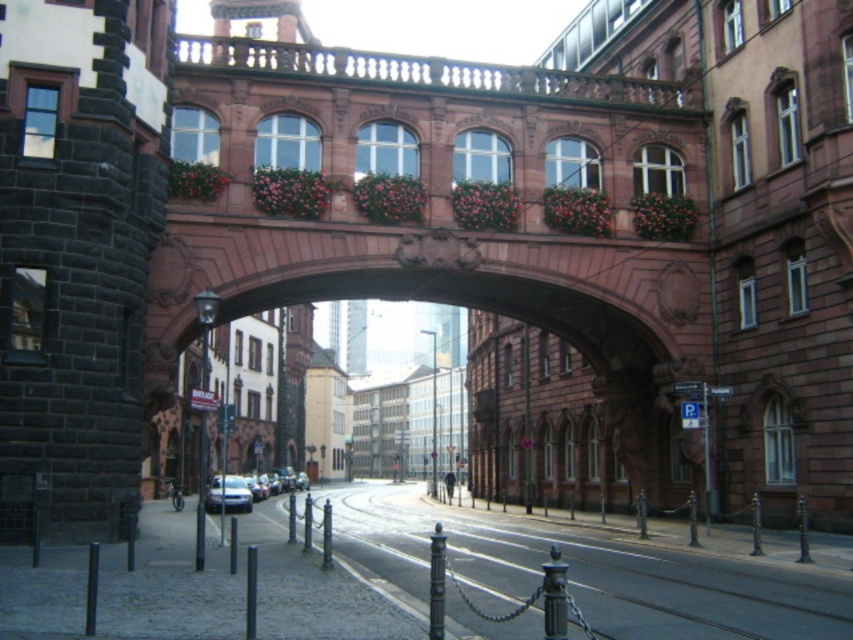
You are standing on the sidewalk observing the scene. You see a metallic gray train track at lower center and a silver metallic car at lower left. Which object is positioned lower in the image?

The metallic gray train track at lower center is below the silver metallic car at lower left, so the train track is positioned lower in the image.